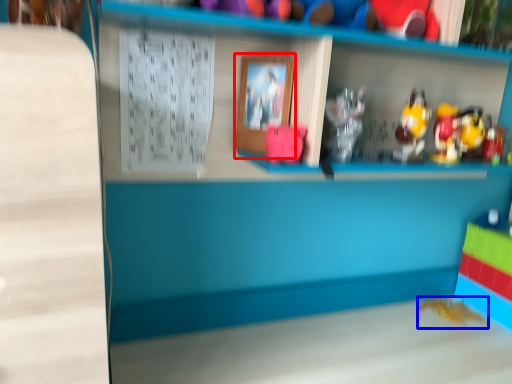
Question: Among these objects, which one is nearest to the camera, picture frame (highlighted by a red box) or toy (highlighted by a blue box)?

Choices:
 (A) picture frame
 (B) toy

Answer: (A)